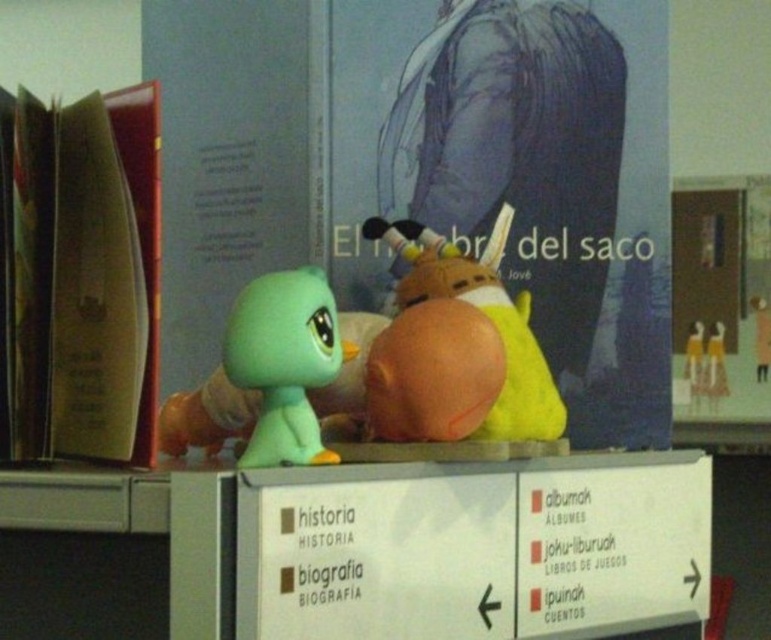
Question: Among these objects, which one is nearest to the camera?

Choices:
 (A) matte blue poster at center
 (B) brown leather book at left
 (C) matte green plastic toy at center

Answer: (C)

Question: Which point appears closest to the camera in this image?

Choices:
 (A) click(x=492, y=384)
 (B) click(x=268, y=417)

Answer: (B)

Question: Is brown leather book at left below yellow fabric toy at center?

Choices:
 (A) no
 (B) yes

Answer: (A)

Question: Does matte green plastic toy at center have a smaller size compared to matte yellow plush at center?

Choices:
 (A) yes
 (B) no

Answer: (B)

Question: Considering the real-world distances, which object is farthest from the brown leather book at left?

Choices:
 (A) matte yellow plush at center
 (B) matte blue poster at center
 (C) matte green plastic toy at center

Answer: (A)

Question: Is brown leather book at left to the right of matte yellow plush at center from the viewer's perspective?

Choices:
 (A) no
 (B) yes

Answer: (A)